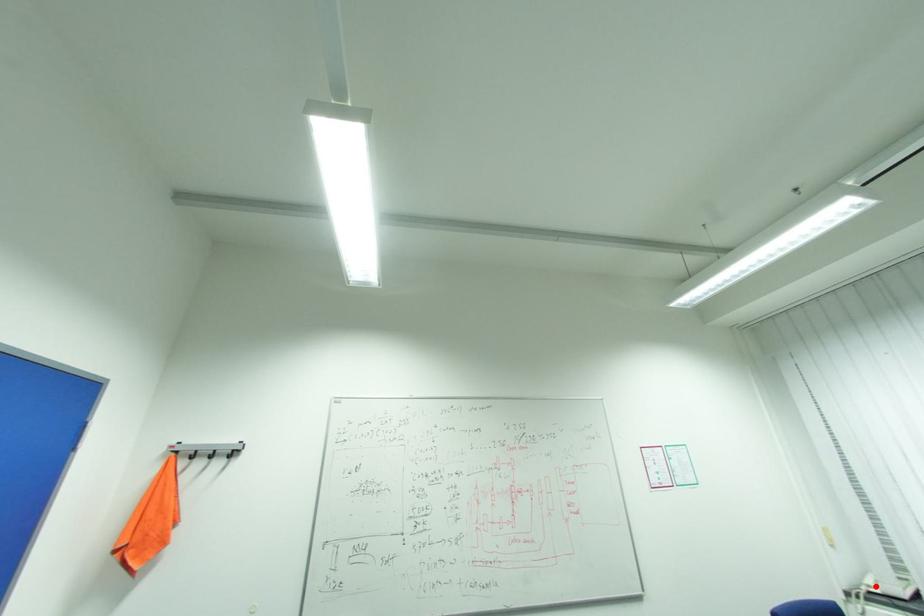
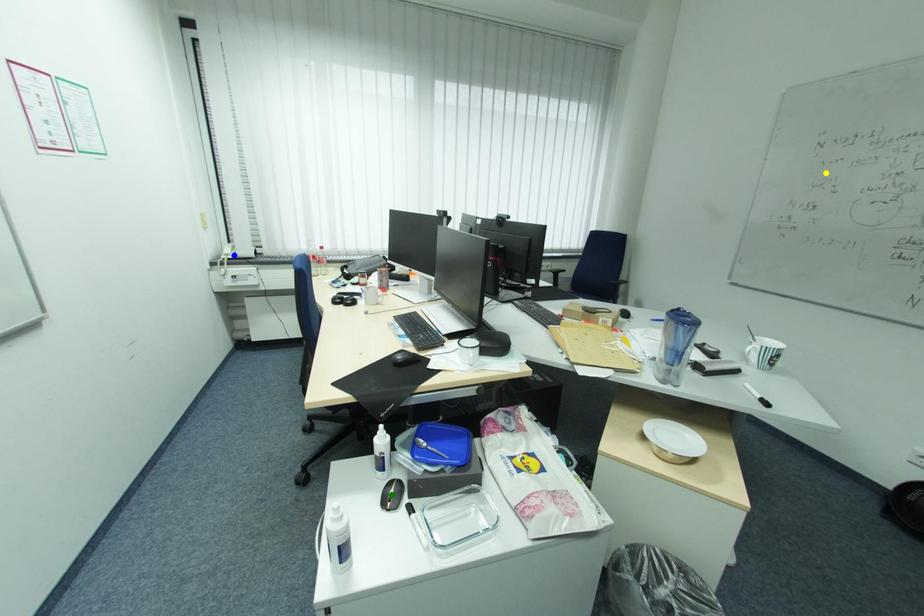
Question: I am providing you with two images of the same scene from different viewpoints. A red point is marked on the first image. You are given multiple points on the second image. Which mark in image 2 goes with the point in image 1?

Choices:
 (A) green point
 (B) yellow point
 (C) blue point

Answer: (C)